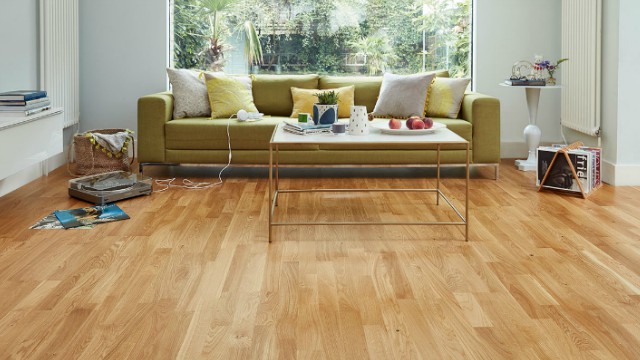
Image resolution: width=640 pixels, height=360 pixels. Identify the location of pillows. (201, 88), (230, 98), (297, 96), (399, 98), (445, 87).